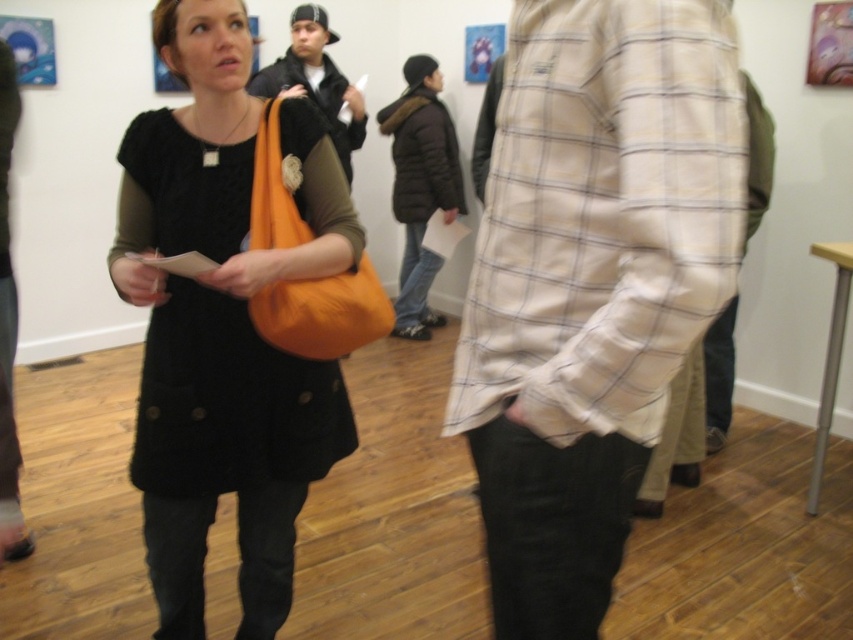
Does orange fabric bag at upper left appear on the left side of matte black jacket at center?

Incorrect, orange fabric bag at upper left is not on the left side of matte black jacket at center.

Between orange fabric bag at upper left and matte black jacket at center, which one appears on the left side from the viewer's perspective?

From the viewer's perspective, matte black jacket at center appears more on the left side.

Identify the location of orange fabric bag at upper left. This screenshot has width=853, height=640. (224, 324).

Does point (621, 186) come in front of point (146, 211)?

Yes, it is in front of point (146, 211).

Is point (540, 72) in front of point (317, 157)?

That is True.

Where is `light beige plaid shirt at center`? The image size is (853, 640). light beige plaid shirt at center is located at coordinates (590, 284).

Who is lower down, light beige plaid shirt at center or matte black jacket at center?

light beige plaid shirt at center

Is light beige plaid shirt at center to the left of matte black jacket at center from the viewer's perspective?

No, light beige plaid shirt at center is not to the left of matte black jacket at center.

Locate an element on the screen. Image resolution: width=853 pixels, height=640 pixels. light beige plaid shirt at center is located at coordinates (590, 284).